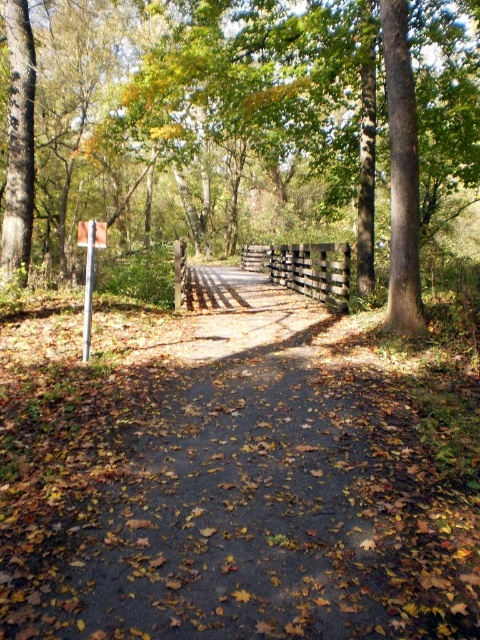
Question: Is brown wood fence at center further to the viewer compared to brown wooden fence at center?

Choices:
 (A) no
 (B) yes

Answer: (A)

Question: Does brown wood fence at center appear over brown wooden fence at center?

Choices:
 (A) yes
 (B) no

Answer: (A)

Question: Among these objects, which one is nearest to the camera?

Choices:
 (A) brown wooden fence at center
 (B) brown wood fence at center

Answer: (B)

Question: Is brown wood fence at center bigger than brown wooden fence at center?

Choices:
 (A) yes
 (B) no

Answer: (A)